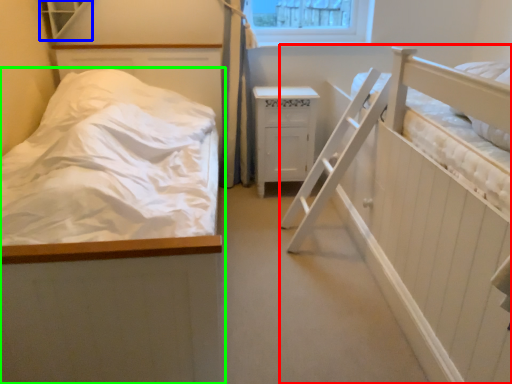
Question: Which is farther away from hospital bed (highlighted by a red box)? window (highlighted by a blue box) or bed (highlighted by a green box)?

Choices:
 (A) window
 (B) bed

Answer: (A)